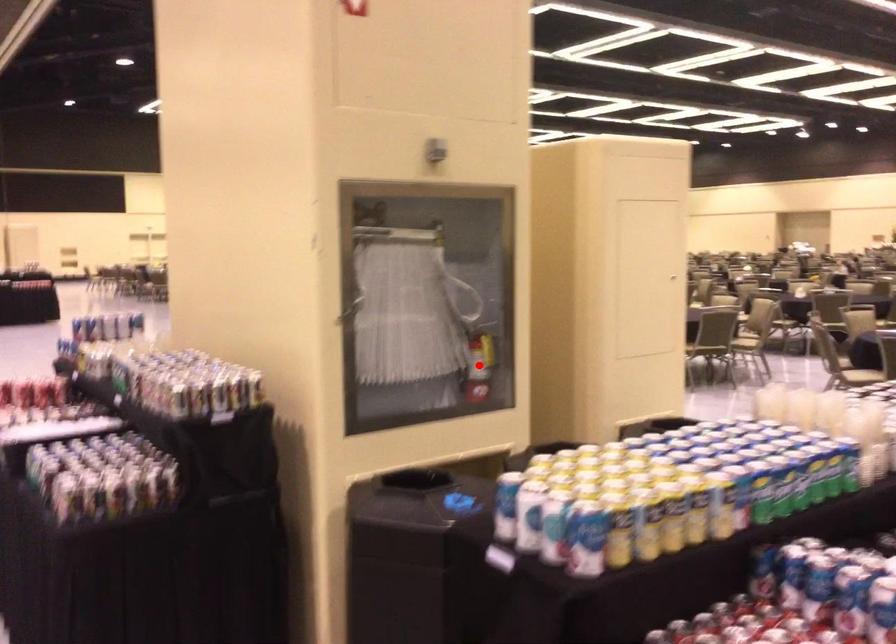
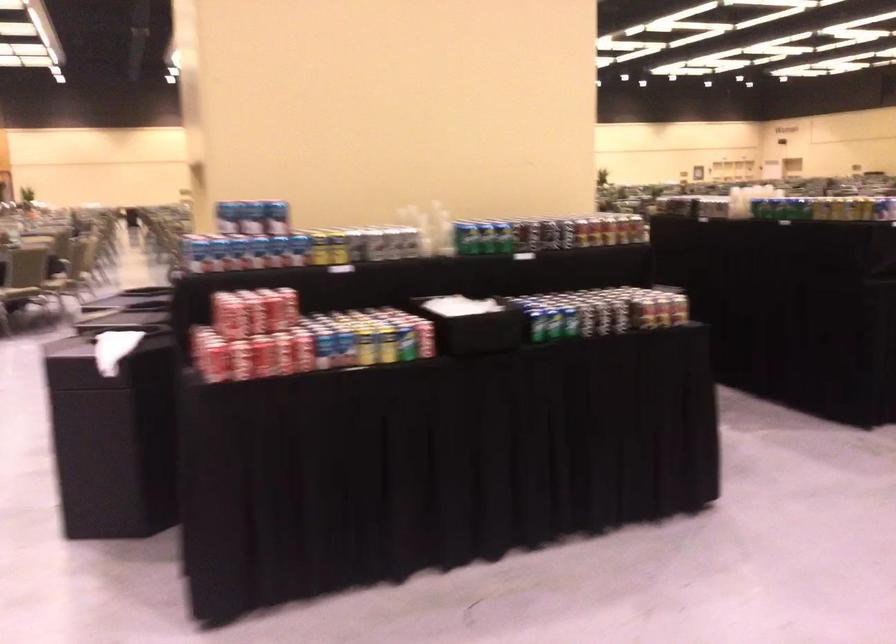
Question: I am providing you with two images of the same scene from different viewpoints. A red point is marked on the first image. Can you still see the location of the red point in image 2?

Choices:
 (A) Yes
 (B) No

Answer: (B)